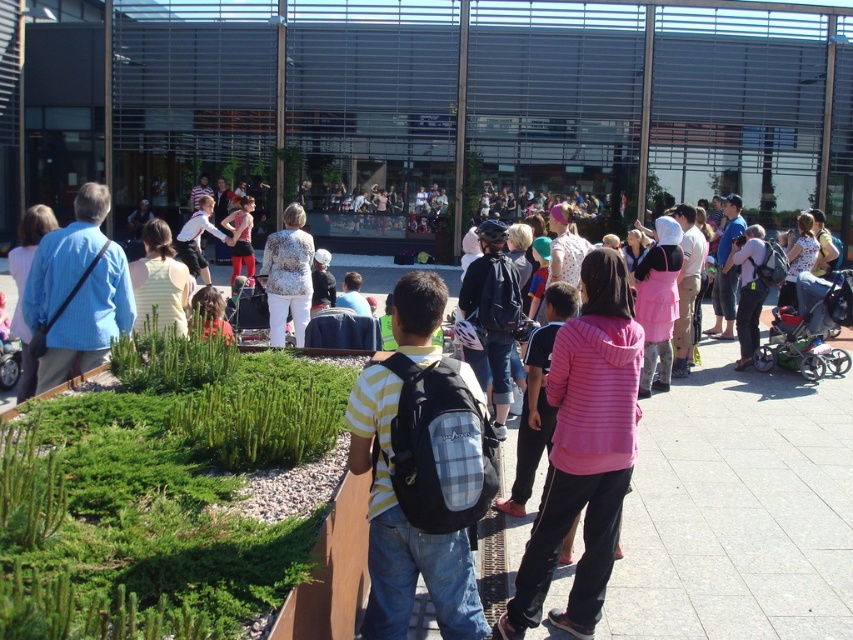
Question: Does yellow and white striped shirt at center have a smaller size compared to floral-patterned blouse at center?

Choices:
 (A) yes
 (B) no

Answer: (A)

Question: Which point is farther from the camera taking this photo?

Choices:
 (A) (486, 445)
 (B) (300, 320)

Answer: (B)

Question: Does yellow and white striped shirt at center have a lesser width compared to floral-patterned blouse at center?

Choices:
 (A) no
 (B) yes

Answer: (B)

Question: Is yellow and white striped shirt at center wider than floral-patterned blouse at center?

Choices:
 (A) yes
 (B) no

Answer: (B)